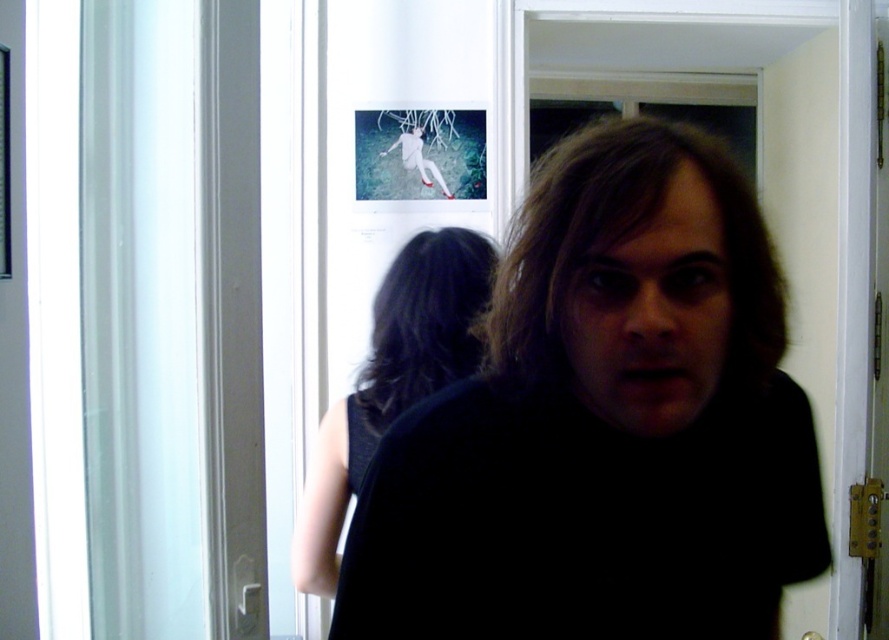
Question: Which point is closer to the camera?

Choices:
 (A) white matte figure at center
 (B) black fabric dress at center
 (C) black fabric at center
 (D) dark brown hair at center

Answer: (C)

Question: Observing the image, what is the correct spatial positioning of black fabric dress at center in reference to white matte figure at center?

Choices:
 (A) left
 (B) right

Answer: (A)

Question: Does brown matte hair at center appear under white matte figure at center?

Choices:
 (A) yes
 (B) no

Answer: (A)

Question: Does black fabric at center have a lesser width compared to black fabric dress at center?

Choices:
 (A) yes
 (B) no

Answer: (B)

Question: Which point is closer to the camera taking this photo?

Choices:
 (A) pyautogui.click(x=378, y=312)
 (B) pyautogui.click(x=658, y=208)

Answer: (B)

Question: Which object is the closest to the white matte figure at center?

Choices:
 (A) brown matte hair at center
 (B) black fabric dress at center

Answer: (B)